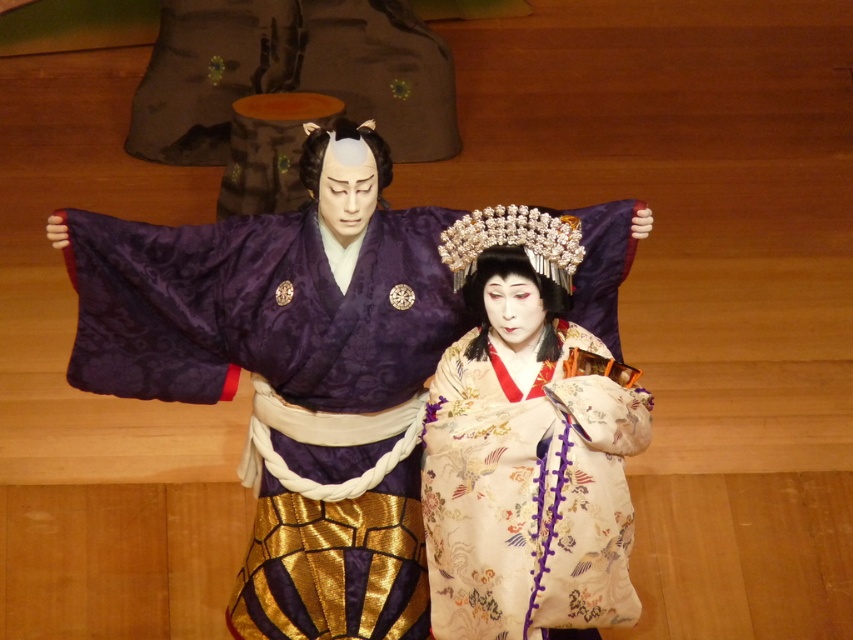
Who is positioned more to the left, silky purple kimono at center or silky beige kimono at center?

Positioned to the left is silky purple kimono at center.

Can you confirm if silky purple kimono at center is taller than silky beige kimono at center?

In fact, silky purple kimono at center may be shorter than silky beige kimono at center.

Describe the element at coordinates (291, 372) in the screenshot. The height and width of the screenshot is (640, 853). I see `silky purple kimono at center` at that location.

Locate an element on the screen. This screenshot has height=640, width=853. silky purple kimono at center is located at coordinates (291, 372).